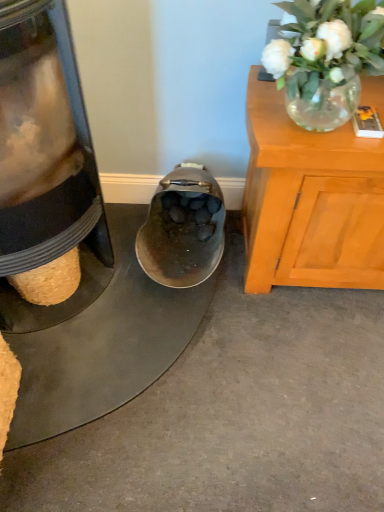
Where is `translucent glass vase at upper right`? The image size is (384, 512). translucent glass vase at upper right is located at coordinates (326, 58).

This screenshot has width=384, height=512. What do you see at coordinates (89, 295) in the screenshot?
I see `metallic bowl at center` at bounding box center [89, 295].

Find the location of a particular element. This screenshot has width=384, height=512. shiny metallic shoe at center is located at coordinates (183, 229).

In terms of width, does translucent glass vase at upper right look wider or thinner when compared to metallic bowl at center?

Considering their sizes, translucent glass vase at upper right looks slimmer than metallic bowl at center.

Locate an element on the screen. Image resolution: width=384 pixels, height=512 pixels. floral arrangement above the metallic bowl at center (from the image's perspective) is located at coordinates (326, 58).

Are translucent glass vase at upper right and metallic bowl at center located far from each other?

That's not correct — translucent glass vase at upper right is a little close to metallic bowl at center.

Is metallic bowl at center a part of translucent glass vase at upper right?

No, metallic bowl at center is located outside of translucent glass vase at upper right.

Is shiny metallic shoe at center not close to metallic bowl at center?

Actually, shiny metallic shoe at center and metallic bowl at center are a little close together.

Can we say shiny metallic shoe at center lies outside metallic bowl at center?

That's correct, shiny metallic shoe at center is outside of metallic bowl at center.

Between shiny metallic shoe at center and metallic bowl at center, which one has larger size?

With larger size is shiny metallic shoe at center.

Is point (201, 227) positioned behind point (290, 25)?

Yes, point (201, 227) is behind point (290, 25).

Can you tell me how much shiny metallic shoe at center and translucent glass vase at upper right differ in facing direction?

0.00066 degrees.

Is shiny metallic shoe at center facing away from translucent glass vase at upper right?

No, translucent glass vase at upper right is not at the back of shiny metallic shoe at center.

In order to click on floral arrangement located in front of the shiny metallic shoe at center in this screenshot , I will do `click(326, 58)`.

Considering the positions of objects translucent glass vase at upper right and shiny metallic shoe at center in the image provided, who is more to the right, translucent glass vase at upper right or shiny metallic shoe at center?

translucent glass vase at upper right is more to the right.

Measure the distance between translucent glass vase at upper right and shiny metallic shoe at center.

21.33 inches.

From a real-world perspective, who is located lower, translucent glass vase at upper right or shiny metallic shoe at center?

shiny metallic shoe at center is physically lower.

Is metallic bowl at center aimed at translucent glass vase at upper right?

No, metallic bowl at center is not facing towards translucent glass vase at upper right.

From the image's perspective, is metallic bowl at center above or below translucent glass vase at upper right?

metallic bowl at center is below translucent glass vase at upper right.

Would you say metallic bowl at center is a long distance from translucent glass vase at upper right?

They are positioned close to each other.

Consider the image. How many degrees apart are the facing directions of metallic bowl at center and shiny metallic shoe at center?

1.52 degrees separate the facing orientations of metallic bowl at center and shiny metallic shoe at center.

Based on the photo, is metallic bowl at center with shiny metallic shoe at center?

There is a gap between metallic bowl at center and shiny metallic shoe at center.

Which is in front, metallic bowl at center or shiny metallic shoe at center?

metallic bowl at center is in front.

Would you say metallic bowl at center is outside shiny metallic shoe at center?

That's correct, metallic bowl at center is outside of shiny metallic shoe at center.

What are the coordinates of `floral arrangement that is in front of the metallic bowl at center` in the screenshot? It's located at (326, 58).

At what (x,y) coordinates should I click in order to perform the action: click on appliance that is on the left side of shiny metallic shoe at center. Please return your answer as a coordinate pair (x, y). Looking at the image, I should click on (89, 295).

Estimate the real-world distances between objects in this image. Which object is closer to metallic bowl at center, shiny metallic shoe at center or translucent glass vase at upper right?

shiny metallic shoe at center is positioned closer to the anchor metallic bowl at center.

From the image, which object appears to be farther from translucent glass vase at upper right, shiny metallic shoe at center or metallic bowl at center?

Based on the image, metallic bowl at center appears to be further to translucent glass vase at upper right.

From the image, which object appears to be farther from translucent glass vase at upper right, metallic bowl at center or shiny metallic shoe at center?

Among the two, metallic bowl at center is located further to translucent glass vase at upper right.

Based on their spatial positions, is translucent glass vase at upper right or metallic bowl at center closer to shiny metallic shoe at center?

metallic bowl at center.

Estimate the real-world distances between objects in this image. Which object is further from metallic bowl at center, translucent glass vase at upper right or shiny metallic shoe at center?

The object further to metallic bowl at center is translucent glass vase at upper right.

Estimate the real-world distances between objects in this image. Which object is closer to shiny metallic shoe at center, metallic bowl at center or translucent glass vase at upper right?

metallic bowl at center is positioned closer to the anchor shiny metallic shoe at center.

Where is `footwear between translucent glass vase at upper right and metallic bowl at center vertically`? This screenshot has height=512, width=384. footwear between translucent glass vase at upper right and metallic bowl at center vertically is located at coordinates (183, 229).